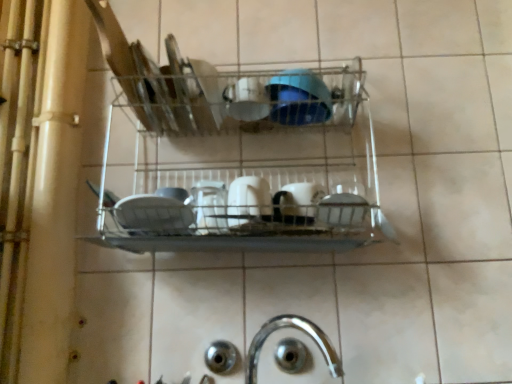
Question: From their relative heights in the image, would you say white glossy mug at center, placed as the third tableware when sorted from top to bottom, is taller or shorter than white glossy cup at upper center, acting as the third tableware starting from the bottom?

Choices:
 (A) short
 (B) tall

Answer: (B)

Question: Considering their positions, is white glossy mug at center, placed as the third tableware when sorted from top to bottom, located in front of or behind white glossy cup at upper center, which is the second tableware from top to bottom?

Choices:
 (A) behind
 (B) front

Answer: (B)

Question: Which is nearer to the white glossy mug at center, the fourth tableware positioned from the top?

Choices:
 (A) white glossy mug at center, placed as the third tableware when sorted from top to bottom
 (B) white glossy cup at upper center, acting as the third tableware starting from the bottom
 (C) silver metallic tap at lower center
 (D) metallic wire rack at center
 (E) blue glossy bowl at center, which appears as the fourth tableware when ordered from the bottom

Answer: (A)

Question: Which object is positioned farthest from the blue glossy bowl at center, which appears as the fourth tableware when ordered from the bottom?

Choices:
 (A) metallic wire rack at center
 (B) white glossy mug at center, the fourth tableware positioned from the top
 (C) silver metallic tap at lower center
 (D) white glossy mug at center, placed as the third tableware when sorted from top to bottom
 (E) white glossy cup at upper center, acting as the third tableware starting from the bottom

Answer: (C)